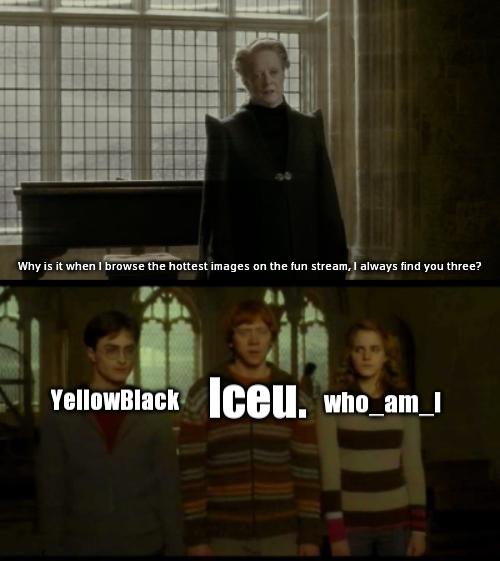
Where is `desk`? desk is located at coordinates (159, 220).